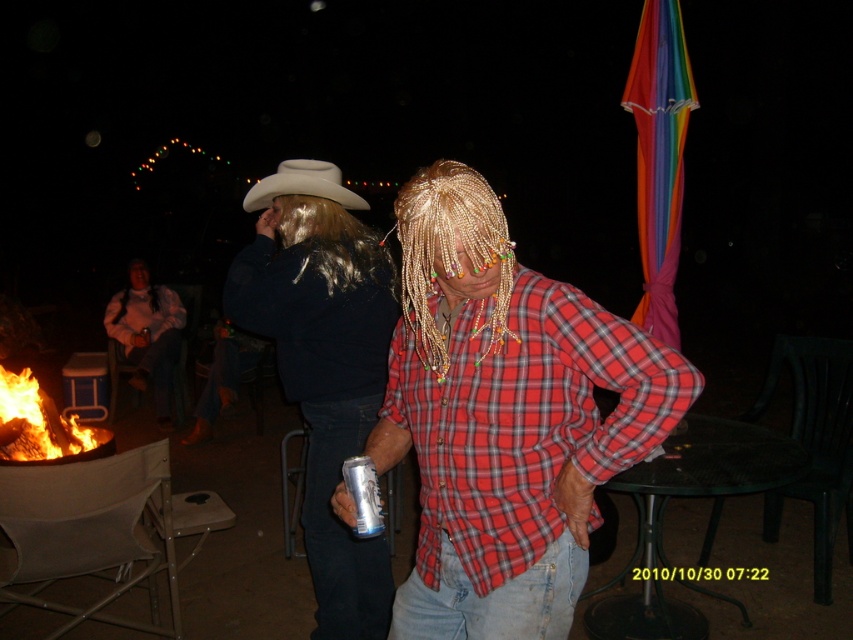
You are a photographer at the event and want to capture a photo of both the matte black cowboy hat at upper left and the matte black jacket at left without any obstruction. Based on their positions, which object should you focus on first to ensure both are in frame?

The matte black cowboy hat at upper left is in front of the matte black jacket at left, so you should focus on the matte black jacket at left first to ensure both are visible without obstruction.

You are at a nighttime gathering and see the red plaid shirt at center and the silver metallic can at center. Which object is positioned to the right?

The red plaid shirt at center is positioned to the right of the silver metallic can at center according to the description.